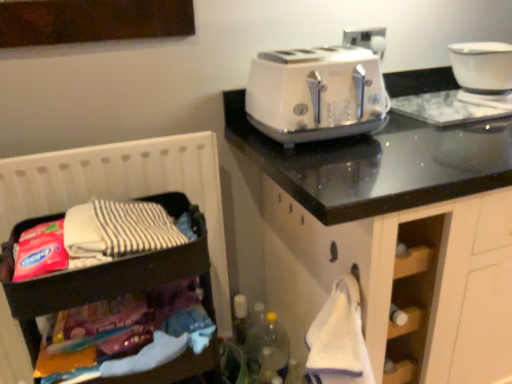
Question: Which is correct: wooden dark brown storage at left is inside white glossy toaster at upper right, or outside of it?

Choices:
 (A) inside
 (B) outside

Answer: (B)

Question: Is wooden dark brown storage at left in front of or behind white glossy toaster at upper right in the image?

Choices:
 (A) front
 (B) behind

Answer: (A)

Question: Considering the real-world distances, which object is farthest from the white glossy bowl at upper right?

Choices:
 (A) white glossy toaster at upper right
 (B) wooden dark brown storage at left

Answer: (B)

Question: Which of these objects is positioned closest to the wooden dark brown storage at left?

Choices:
 (A) white glossy toaster at upper right
 (B) white glossy bowl at upper right

Answer: (A)